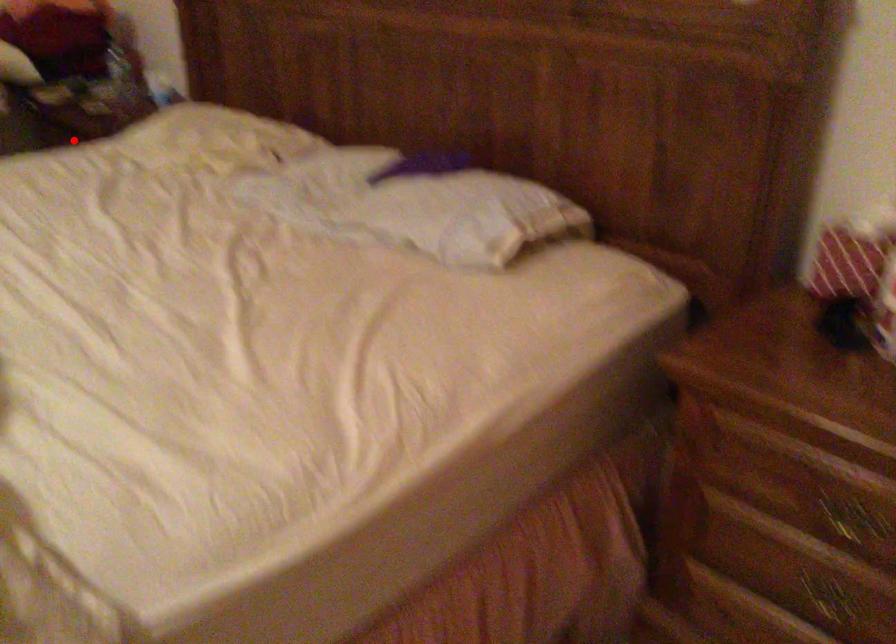
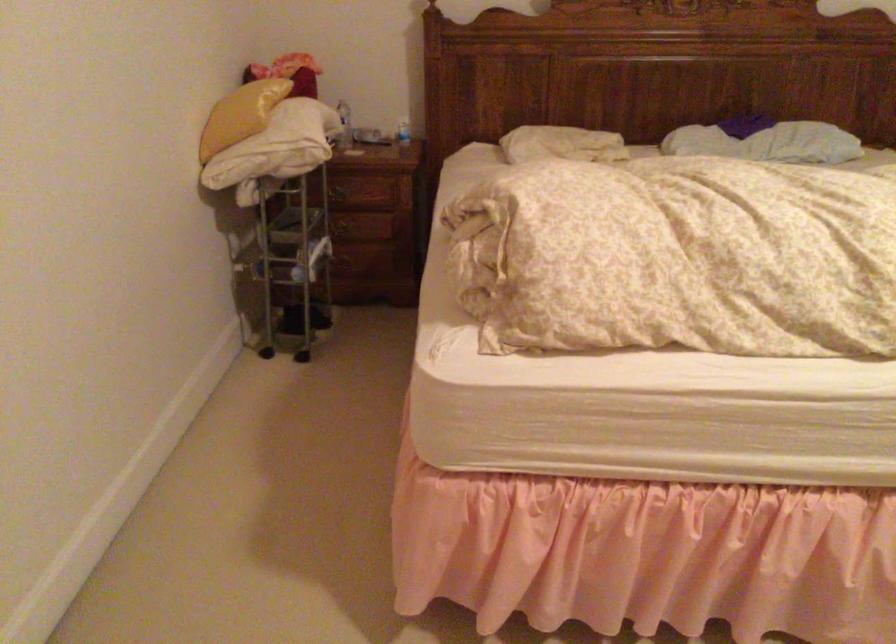
Locate, in the second image, the point that corresponds to the highlighted location in the first image.

(338, 194)